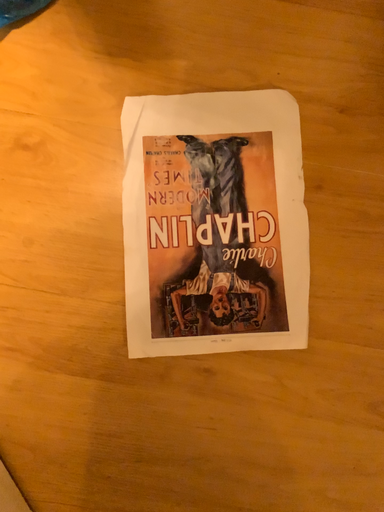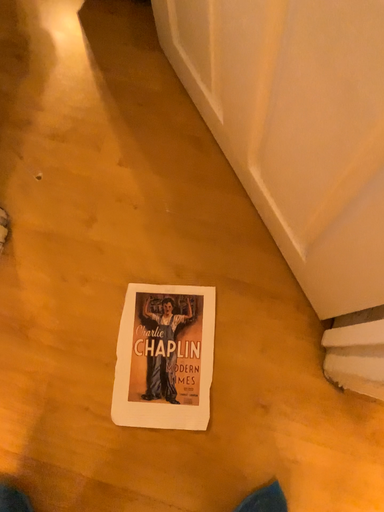
Question: How did the camera likely rotate when shooting the video?

Choices:
 (A) rotated downward
 (B) rotated upward

Answer: (B)